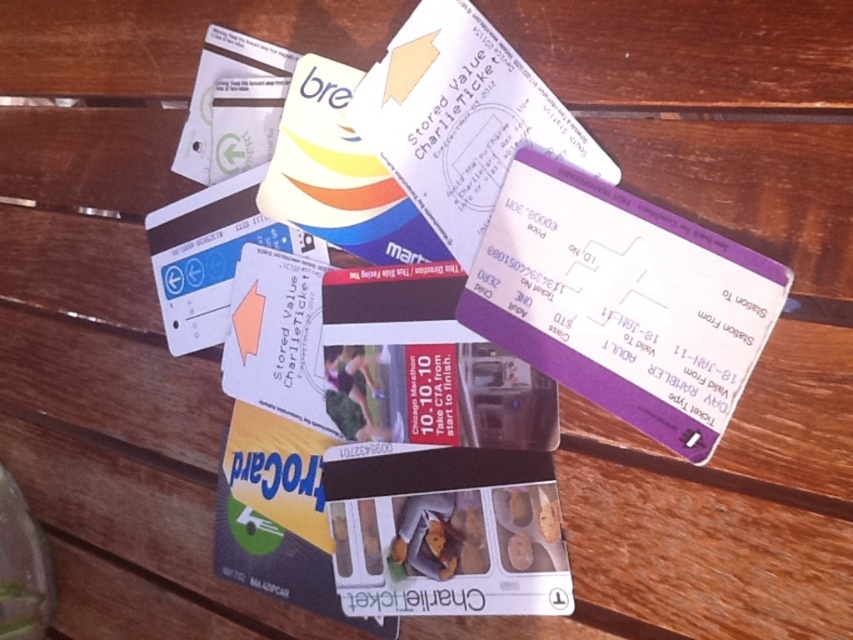
You are organizing the transportation tickets on the wooden surface. You need to place a new ticket between the purple card at upper right and the transparent plastic ticket at center. Is there enough space to fit a new ticket that is 5 inches long?

The distance between the purple card at upper right and the transparent plastic ticket at center is 4.74 inches. Since the new ticket is 5 inches long, it would not fit in the available space.

You are organizing a collection of travel documents on a desk. You have a purple card at upper right and a transparent plastic ticket at center. Which one is taller?

The purple card at upper right is taller than the transparent plastic ticket at center.